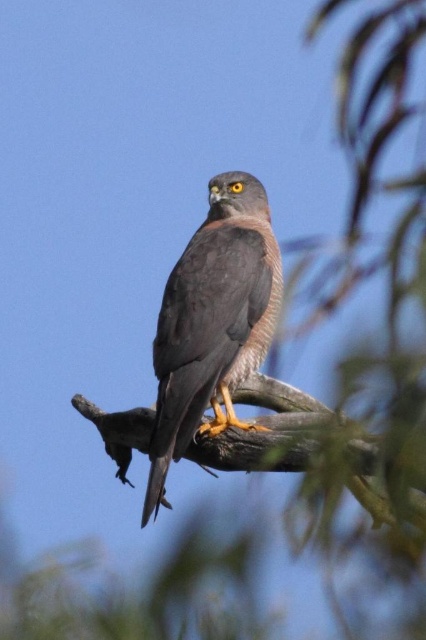
Is point (207, 385) positioned in front of point (365, 481)?

No, (207, 385) is behind (365, 481).

Does dark gray feathers at center have a lesser width compared to smooth gray wood at center?

Correct, dark gray feathers at center's width is less than smooth gray wood at center's.

The image size is (426, 640). Find the location of `dark gray feathers at center`. dark gray feathers at center is located at coordinates (213, 321).

Locate an element on the screen. dark gray feathers at center is located at coordinates (213, 321).